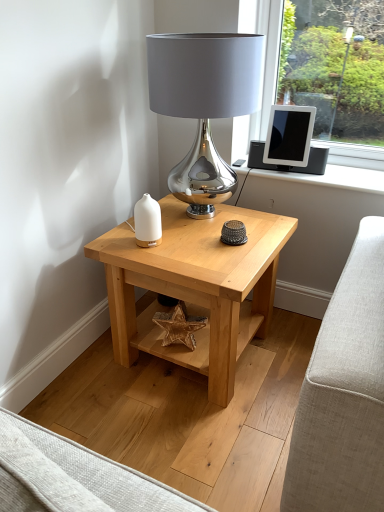
Question: Is satin silver lamp at center to the left of light wood table at center from the viewer's perspective?

Choices:
 (A) yes
 (B) no

Answer: (B)

Question: Is satin silver lamp at center smaller than light wood table at center?

Choices:
 (A) no
 (B) yes

Answer: (B)

Question: From a real-world perspective, does satin silver lamp at center sit lower than light wood table at center?

Choices:
 (A) yes
 (B) no

Answer: (B)

Question: Considering the relative positions of satin silver lamp at center and light wood table at center in the image provided, is satin silver lamp at center behind light wood table at center?

Choices:
 (A) yes
 (B) no

Answer: (B)

Question: Is satin silver lamp at center positioned far away from light wood table at center?

Choices:
 (A) yes
 (B) no

Answer: (B)

Question: Is satin silver lamp at center in front of or behind matte black tablet at upper right in the image?

Choices:
 (A) behind
 (B) front

Answer: (B)

Question: Is point (172, 96) positioned closer to the camera than point (311, 109)?

Choices:
 (A) closer
 (B) farther

Answer: (A)

Question: From the image's perspective, is satin silver lamp at center positioned above or below matte black tablet at upper right?

Choices:
 (A) above
 (B) below

Answer: (B)

Question: Is satin silver lamp at center wider or thinner than matte black tablet at upper right?

Choices:
 (A) thin
 (B) wide

Answer: (B)

Question: From the image's perspective, relative to matte black tablet at upper right, is light wood table at center above or below?

Choices:
 (A) below
 (B) above

Answer: (A)

Question: Considering the positions of light wood table at center and matte black tablet at upper right in the image, is light wood table at center bigger or smaller than matte black tablet at upper right?

Choices:
 (A) big
 (B) small

Answer: (A)

Question: Considering the relative positions of light wood table at center and matte black tablet at upper right in the image provided, is light wood table at center to the left or to the right of matte black tablet at upper right?

Choices:
 (A) left
 (B) right

Answer: (A)

Question: Is point (258, 224) positioned closer to the camera than point (297, 147)?

Choices:
 (A) closer
 (B) farther

Answer: (A)

Question: Is satin silver lamp at center in front of or behind white matte vase at center in the image?

Choices:
 (A) front
 (B) behind

Answer: (A)

Question: From the image's perspective, is satin silver lamp at center located above or below white matte vase at center?

Choices:
 (A) below
 (B) above

Answer: (B)